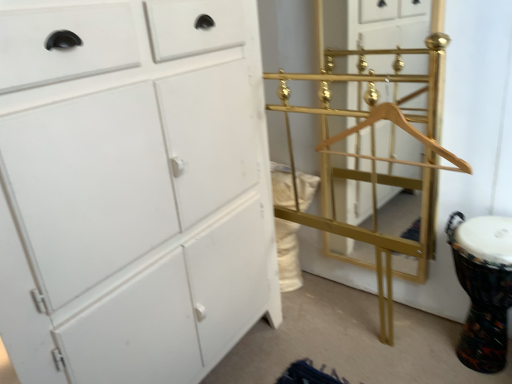
This screenshot has width=512, height=384. Identify the location of vacant region below multicolored fabric drum at lower right (from a real-world perspective). pyautogui.click(x=471, y=359).